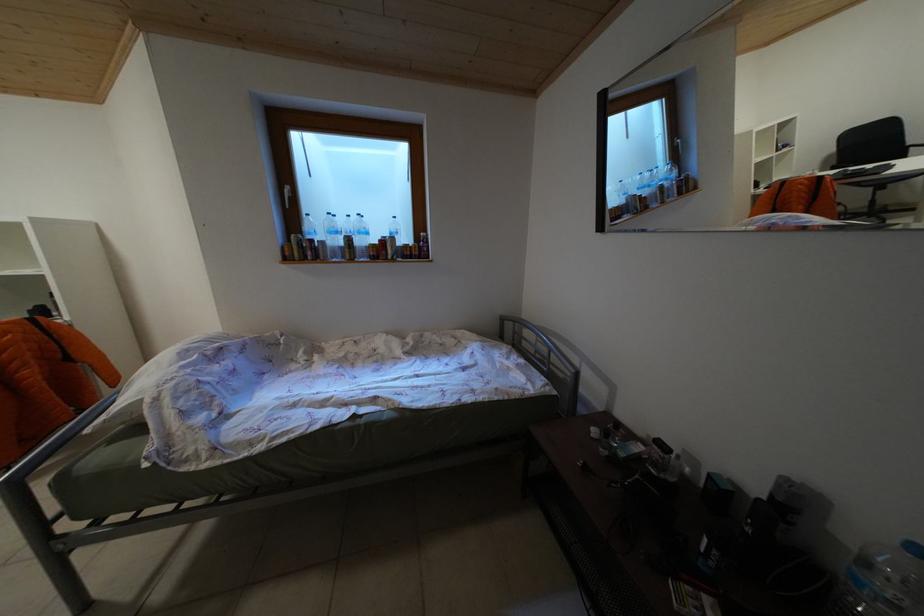
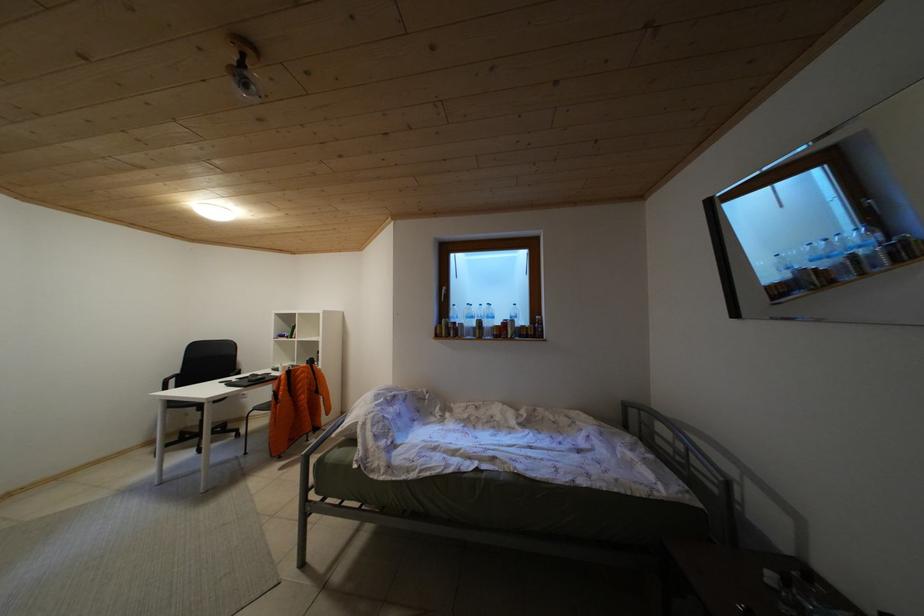
The first image is from the beginning of the video and the second image is from the end. How did the camera likely rotate when shooting the video?

The camera's rotation is toward left-up.